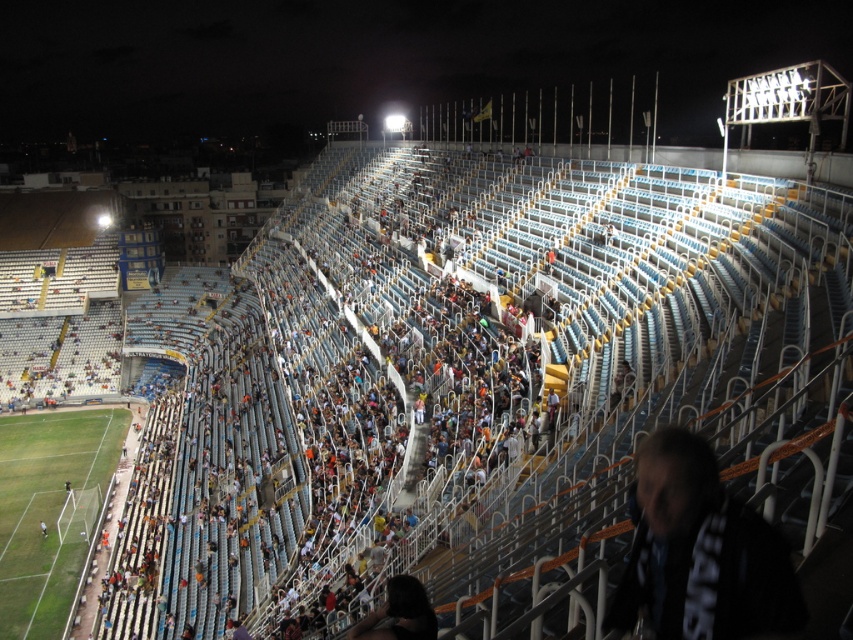
The image size is (853, 640). What do you see at coordinates (700, 552) in the screenshot?
I see `dark fabric jacket at lower right` at bounding box center [700, 552].

Can you confirm if dark fabric jacket at lower right is positioned to the left of dark hair at lower center?

No, dark fabric jacket at lower right is not to the left of dark hair at lower center.

The width and height of the screenshot is (853, 640). What do you see at coordinates (700, 552) in the screenshot?
I see `dark fabric jacket at lower right` at bounding box center [700, 552].

You are a GUI agent. You are given a task and a screenshot of the screen. Output one action in this format:
    pyautogui.click(x=<x>, y=<y>)
    Task: Click on the dark fabric jacket at lower right
    The width and height of the screenshot is (853, 640).
    Given the screenshot: What is the action you would take?
    pyautogui.click(x=700, y=552)

Which is above, green grass football field at lower left or dark hair at lower center?

dark hair at lower center

Can you confirm if green grass football field at lower left is positioned to the right of dark hair at lower center?

Incorrect, green grass football field at lower left is not on the right side of dark hair at lower center.

What are the coordinates of `green grass football field at lower left` in the screenshot? It's located at (47, 509).

Find the location of a particular element. The width and height of the screenshot is (853, 640). green grass football field at lower left is located at coordinates (47, 509).

Can you confirm if dark fabric jacket at lower right is wider than green grass football field at lower left?

No.

In order to click on dark fabric jacket at lower right in this screenshot , I will do `click(700, 552)`.

Which is in front, point (635, 554) or point (28, 572)?

Point (635, 554) is more forward.

This screenshot has height=640, width=853. In order to click on dark fabric jacket at lower right in this screenshot , I will do `click(700, 552)`.